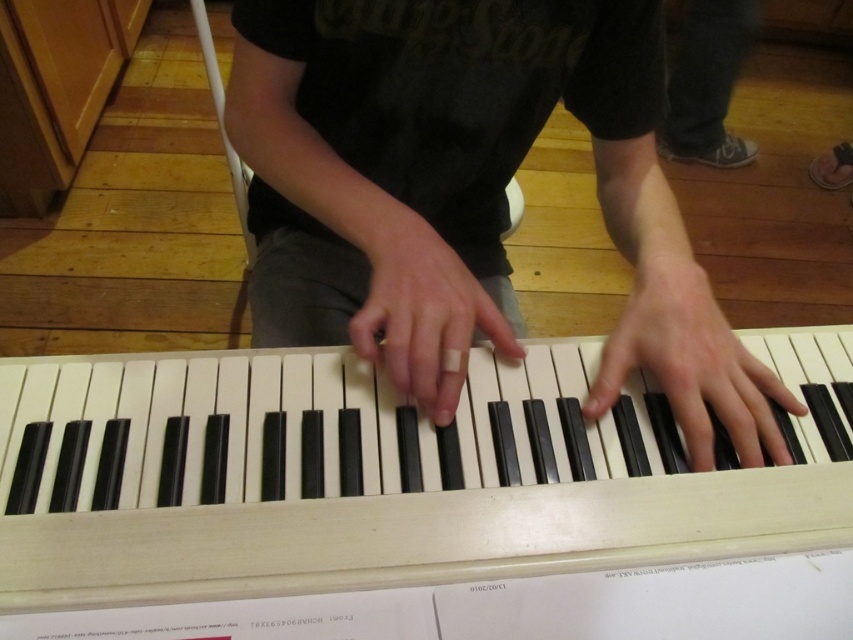
Question: Which point appears closest to the camera in this image?

Choices:
 (A) (408, 250)
 (B) (679, 474)
 (C) (666, 316)
 (D) (451, 298)

Answer: (B)

Question: Can you confirm if white plastic piano at center is smaller than matte black piano keys at center?

Choices:
 (A) yes
 (B) no

Answer: (A)

Question: Can you confirm if matte black piano keys at center is positioned above satin black piano keys at center?

Choices:
 (A) no
 (B) yes

Answer: (B)

Question: Considering the real-world distances, which object is farthest from the matte black piano keys at center?

Choices:
 (A) satin black piano keys at center
 (B) white matte finger at center

Answer: (A)

Question: Is white plastic piano at center smaller than satin black piano keys at center?

Choices:
 (A) yes
 (B) no

Answer: (B)

Question: Among these objects, which one is nearest to the camera?

Choices:
 (A) white plastic piano at center
 (B) satin black piano keys at center
 (C) matte black piano keys at center
 (D) white matte finger at center

Answer: (A)